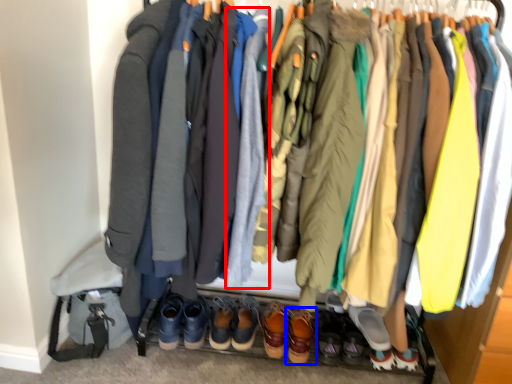
Question: Among these objects, which one is nearest to the camera, robe (highlighted by a red box) or footwear (highlighted by a blue box)?

Choices:
 (A) robe
 (B) footwear

Answer: (A)